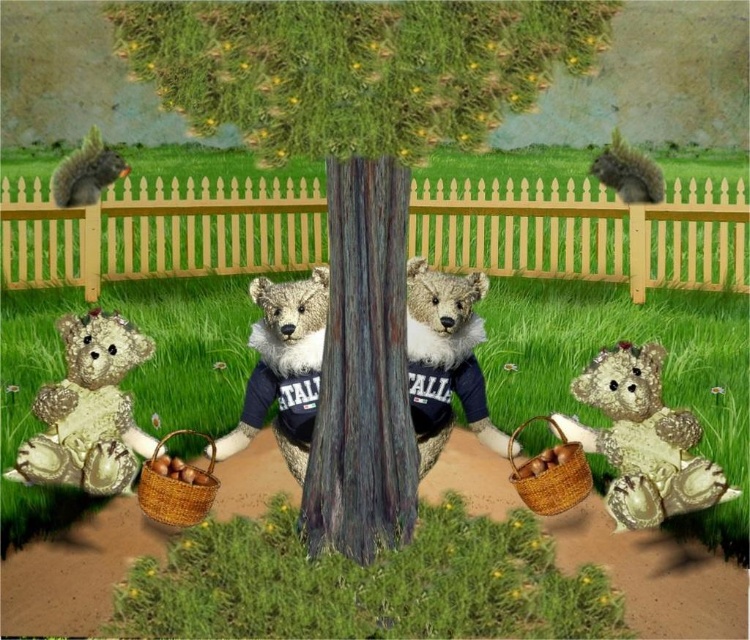
Question: Among these points, which one is farthest from the camera?

Choices:
 (A) (354, 381)
 (B) (82, 464)
 (C) (153, 504)

Answer: (B)

Question: Can you confirm if fluffy beige teddy bear at lower left is positioned to the left of gray furry squirrel at upper left?

Choices:
 (A) yes
 (B) no

Answer: (B)

Question: Which is farther from the brown woven basket at lower left?

Choices:
 (A) fluffy beige teddy bear at lower right
 (B) gray furry squirrel at upper left

Answer: (B)

Question: Which point is farther to the camera?

Choices:
 (A) (474, 76)
 (B) (555, 468)

Answer: (B)

Question: Is brown woven basket at lower left above gray furry squirrel at upper left?

Choices:
 (A) yes
 (B) no

Answer: (B)

Question: Where is fluffy beige teddy bear at lower left located in relation to brown woven basket at lower left in the image?

Choices:
 (A) below
 (B) above

Answer: (B)